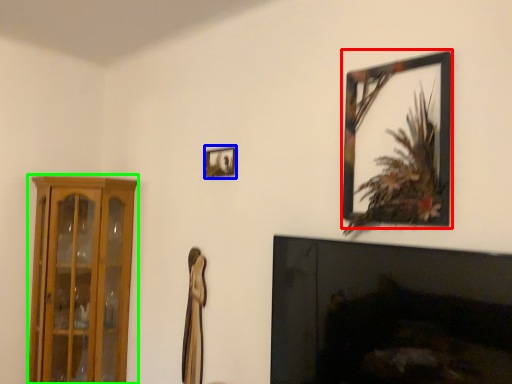
Question: Estimate the real-world distances between objects in this image. Which object is closer to picture frame (highlighted by a red box), picture frame (highlighted by a blue box) or cabinetry (highlighted by a green box)?

Choices:
 (A) picture frame
 (B) cabinetry

Answer: (A)